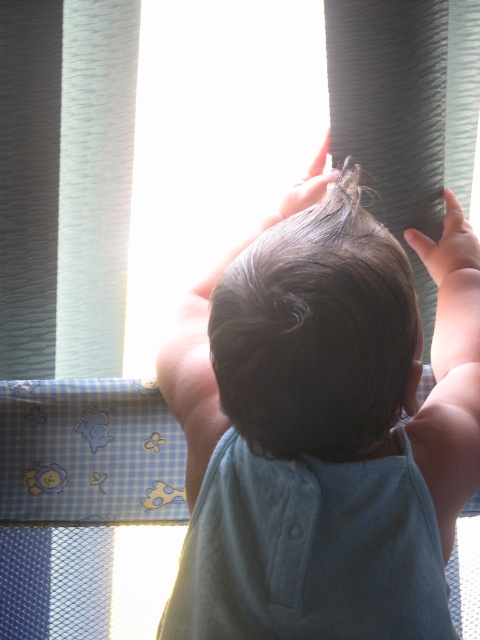
You are a parent trying to ensure your child is safe near the window. You notice two points marked in the scene. The first point is at coordinates point (424,488) and the second is at point (445,236). Which point is closer to the child?

Point (424,488) is in front of point (445,236), so it is closer to the child.

You are a photographer trying to capture the child reaching for the window. You need to ensure both the dark brown hair at center and the smooth skin hand at upper right are clearly visible. Which object should you focus on to ensure it appears larger in the photo?

The dark brown hair at center should be focused on because it has a larger size compared to the smooth skin hand at upper right.

You are a photographer trying to capture the child reaching for the window. Based on the scene, which object is positioned to the left of the other between the dark brown smooth hair at center and the smooth skin hand at upper right?

The dark brown smooth hair at center is positioned to the left of the smooth skin hand at upper right.